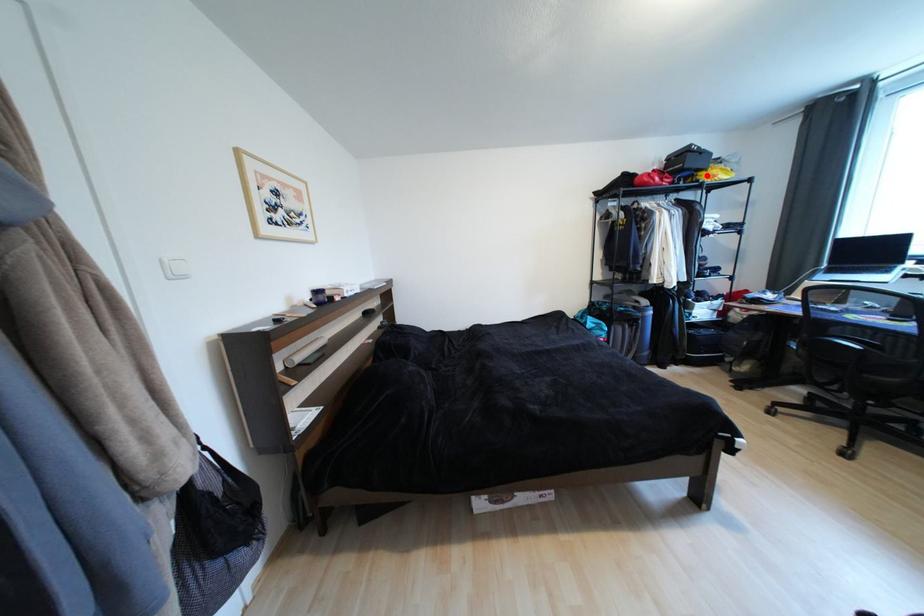
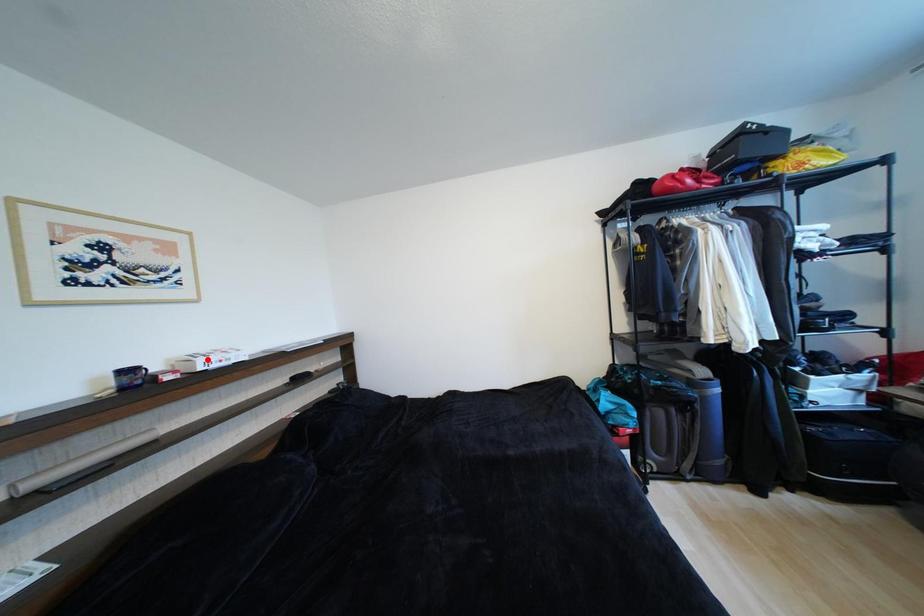
I am providing you with two images of the same scene from different viewpoints. A red point is marked on the first image and another point is marked on the second image. Is the red point in image1 aligned with the point shown in image2?

No